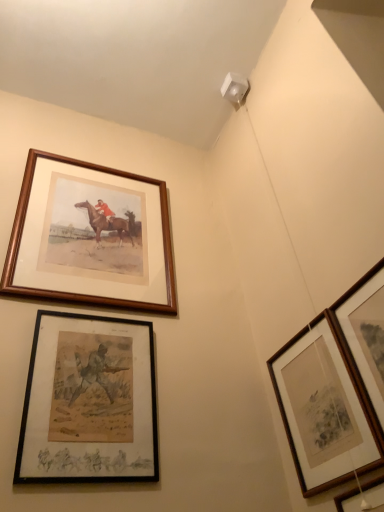
Question: In terms of width, does wooden picture frame at lower right, arranged as the second picture frame when viewed from the right, look wider or thinner when compared to wooden framed print at lower right, which is the third picture frame in right-to-left order?

Choices:
 (A) thin
 (B) wide

Answer: (B)

Question: Visually, is wooden picture frame at lower right, arranged as the second picture frame when viewed from the right, positioned to the left or to the right of wooden framed print at lower right, which appears as the 3th picture frame when viewed from the left?

Choices:
 (A) right
 (B) left

Answer: (A)

Question: Which is nearer to the wooden framed print at lower right, which is the third picture frame in right-to-left order?

Choices:
 (A) black matte picture frame at lower left, which ranks as the 4th picture frame in right-to-left order
 (B) wooden picture frame at upper right, marked as the first picture frame in a right-to-left arrangement
 (C) wooden picture frame at lower right, the 4th picture frame viewed from the left
 (D) wooden frame at upper left, the fifth picture frame in the right-to-left sequence

Answer: (B)

Question: Which object is the closest to the wooden picture frame at lower right, arranged as the second picture frame when viewed from the right?

Choices:
 (A) black matte picture frame at lower left, which ranks as the 4th picture frame in right-to-left order
 (B) wooden picture frame at upper right, marked as the fifth picture frame in a left-to-right arrangement
 (C) wooden framed print at lower right, which appears as the 3th picture frame when viewed from the left
 (D) wooden frame at upper left, the fifth picture frame in the right-to-left sequence

Answer: (C)